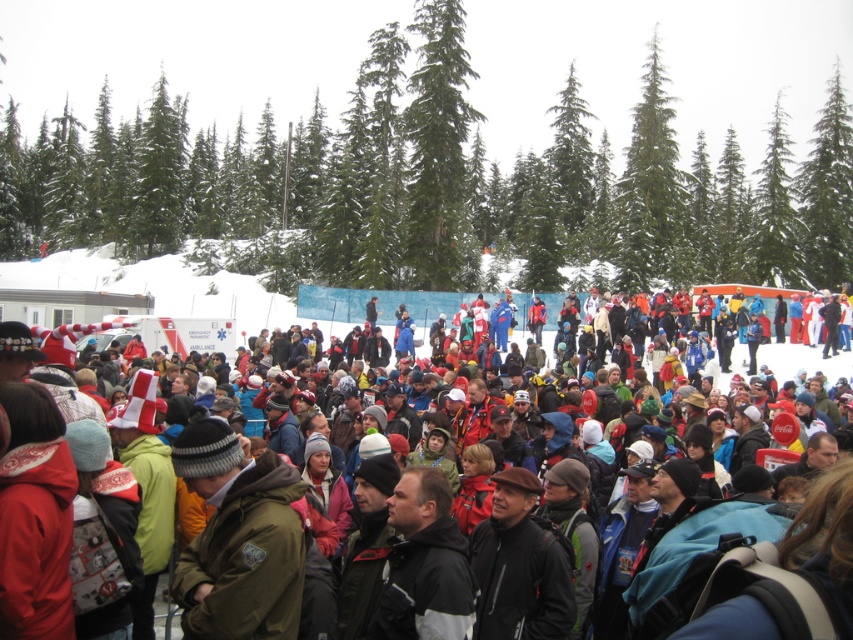
You are standing in the winter sports event area and want to take a photo of the matte black jacket at center without the green textured trees at upper center blocking the view. Is it possible?

The green textured trees at upper center are further to the viewer than the matte black jacket at center, so they are closer to you. To avoid the trees blocking the view of the matte black jacket at center, you need to move your position so that the trees are no longer in front of the jacket.

You are a photographer trying to capture a clear shot of the matte black jacket at center without the green textured trees at upper center blocking the view. Based on their positions, can you position yourself so that the trees don not obscure the jacket?

The green textured trees at upper center might be wider than the matte black jacket at center, so positioning yourself to avoid the trees might be challenging. You may need to move to the side to ensure the jacket is visible without obstruction.

You are standing in the winter sports event area and want to take a photo of the matte black jacket at center without the green textured trees at upper center blocking the view. Is it possible to do so by adjusting your camera angle?

The green textured trees at upper center are positioned over the matte black jacket at center, so if you lower your camera angle slightly, you can avoid the trees blocking the view of the matte black jacket at center.